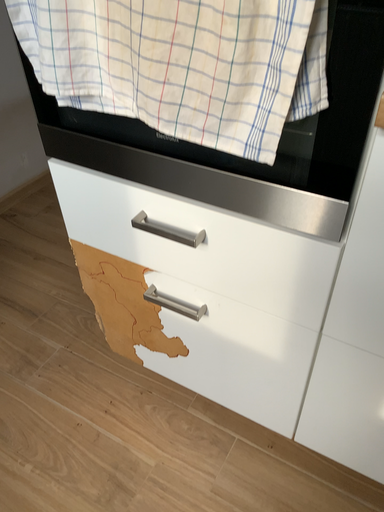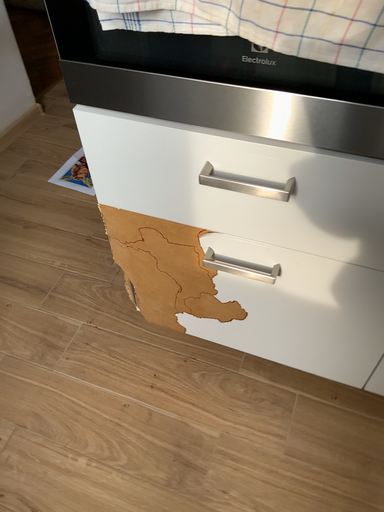
Question: How did the camera likely rotate when shooting the video?

Choices:
 (A) rotated downward
 (B) rotated upward

Answer: (A)